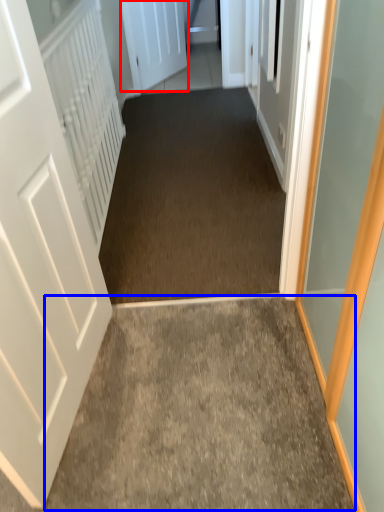
Question: Among these objects, which one is farthest to the camera, door (highlighted by a red box) or path (highlighted by a blue box)?

Choices:
 (A) door
 (B) path

Answer: (A)